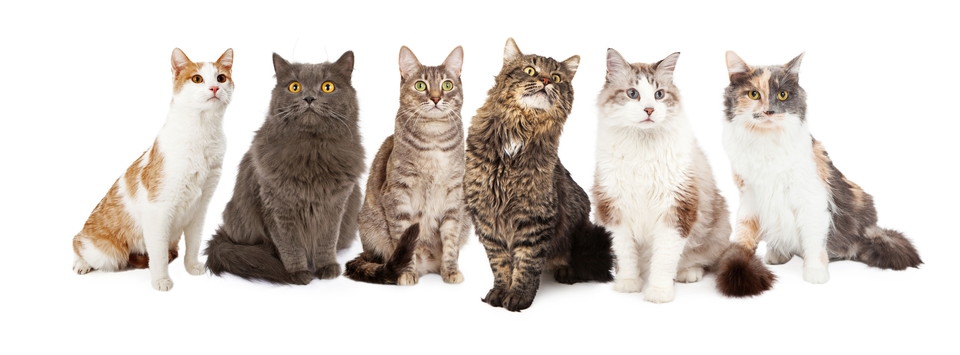
The image size is (960, 355). Identify the location of chest. (204, 159), (308, 185), (432, 183), (502, 183), (648, 184), (771, 166).